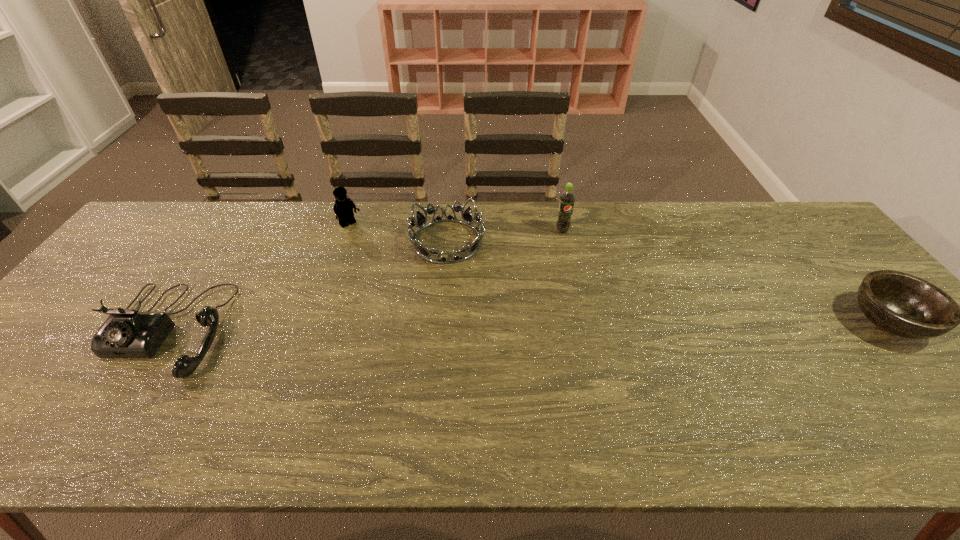
Locate an element on the screen. This screenshot has width=960, height=540. vacant area between the bowl and the telephone is located at coordinates (528, 326).

Where is `empty location between the second object from left to right and the tallest object`? empty location between the second object from left to right and the tallest object is located at coordinates (456, 228).

Image resolution: width=960 pixels, height=540 pixels. Find the location of `free space between the tiara and the bowl`. free space between the tiara and the bowl is located at coordinates (667, 282).

Where is `free area in between the second object from left to right and the tiara`? The height and width of the screenshot is (540, 960). free area in between the second object from left to right and the tiara is located at coordinates (398, 233).

Find the location of a particular element. The image size is (960, 540). free space between the leftmost object and the tallest object is located at coordinates (366, 280).

Locate an element on the screen. Image resolution: width=960 pixels, height=540 pixels. vacant area that lies between the second object from left to right and the third object from right to left is located at coordinates (398, 233).

This screenshot has height=540, width=960. I want to click on free area in between the Lego and the third object from left to right, so click(x=398, y=233).

In order to click on object identified as the closest to the bowl in this screenshot , I will do `click(567, 198)`.

Locate an element on the screen. The image size is (960, 540). the second closest object to the Lego is located at coordinates (127, 333).

Where is `vacant space that satisfies the following two spatial constraints: 1. on the front side of the Lego; 2. on the right side of the tiara`? vacant space that satisfies the following two spatial constraints: 1. on the front side of the Lego; 2. on the right side of the tiara is located at coordinates (345, 241).